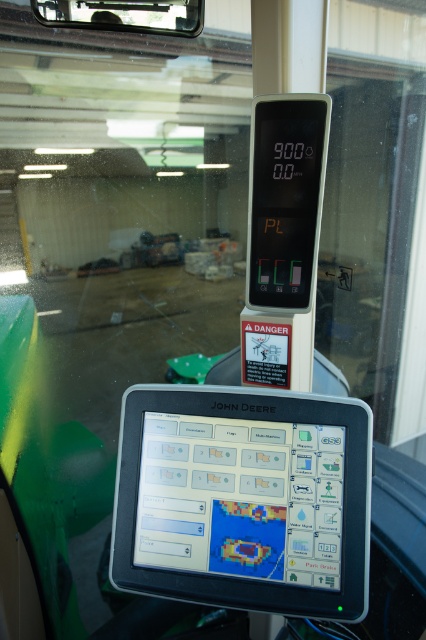
Question: Can you confirm if black plastic tablet computer at center is smaller than black plastic display at upper center?

Choices:
 (A) yes
 (B) no

Answer: (B)

Question: Which object appears closest to the camera in this image?

Choices:
 (A) black plastic display at upper center
 (B) black plastic tablet computer at center

Answer: (B)

Question: Among these points, which one is nearest to the camera?

Choices:
 (A) (359, 436)
 (B) (296, 124)

Answer: (A)

Question: Does black plastic tablet computer at center have a smaller size compared to black plastic display at upper center?

Choices:
 (A) yes
 (B) no

Answer: (B)

Question: In this image, where is black plastic tablet computer at center located relative to black plastic display at upper center?

Choices:
 (A) left
 (B) right

Answer: (A)